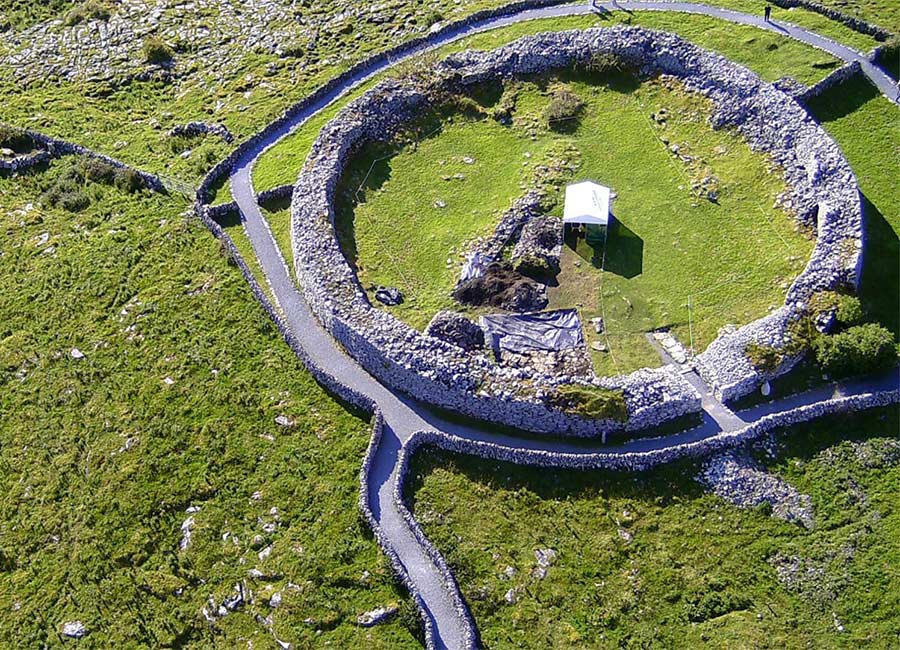
This screenshot has height=650, width=900. I want to click on wall, so click(446, 361).